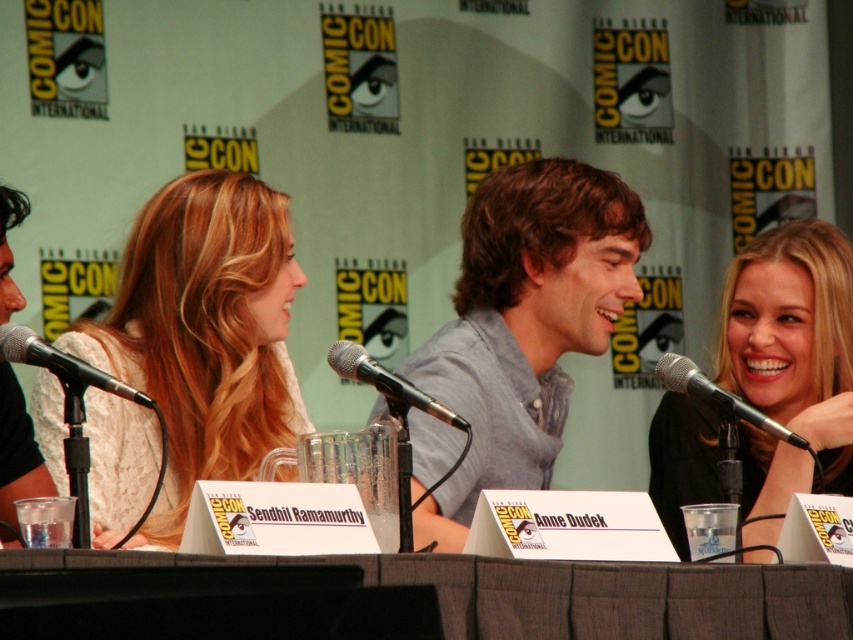
You are a photographer at Comic Con and need to capture a photo of the gray cotton shirt at center and the black metallic microphone at left. Based on their positions, which object is located to the right of the other?

The gray cotton shirt at center is positioned on the right side of black metallic microphone at left.

You are attending Comic Con and want to take a photo of the panel discussion. You notice the black fabric table at center and the blonde hair at upper right. Which object is positioned closer to you?

The black fabric table at center is closer to the viewer than the blonde hair at upper right, so the black fabric table at center is positioned closer to you.

In the scene shown: You are a photographer at Comic Con and need to capture a closeup of the black metallic microphone at left without including the white lace dress at center in the shot. Given their relative sizes, is this possible?

The white lace dress at center is wider than the black metallic microphone at left, so it might be challenging to capture the microphone closeup without including the dress, as the dress occupies more horizontal space.